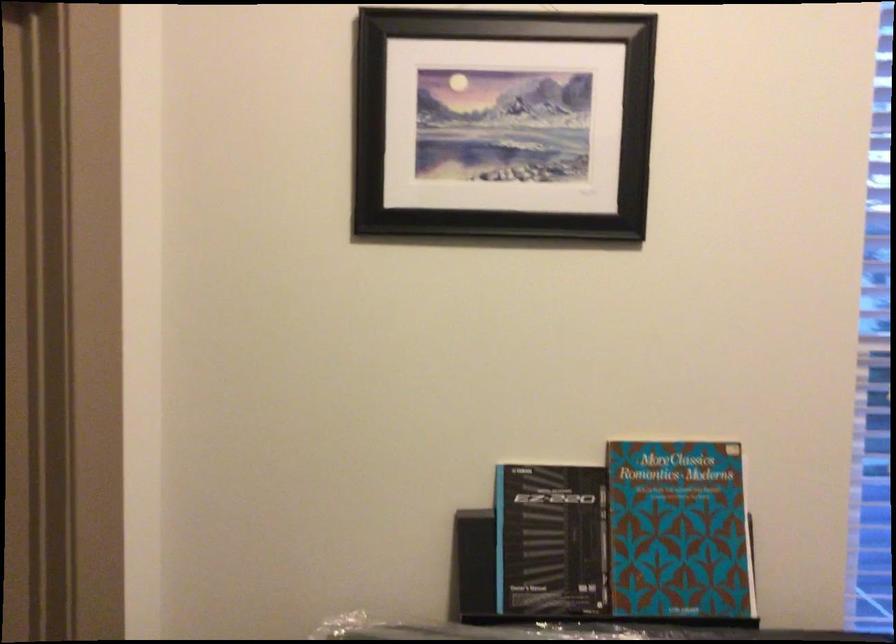
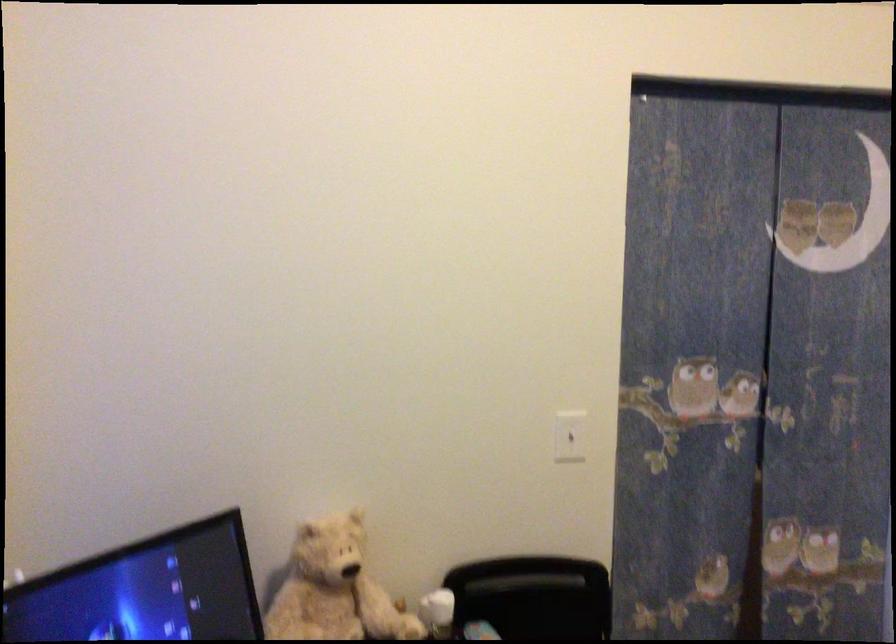
Question: The camera is either moving clockwise (left) or counter-clockwise (right) around the object. The first image is from the beginning of the video and the second image is from the end. Is the camera moving left or right when shooting the video?

Choices:
 (A) Left
 (B) Right

Answer: (A)